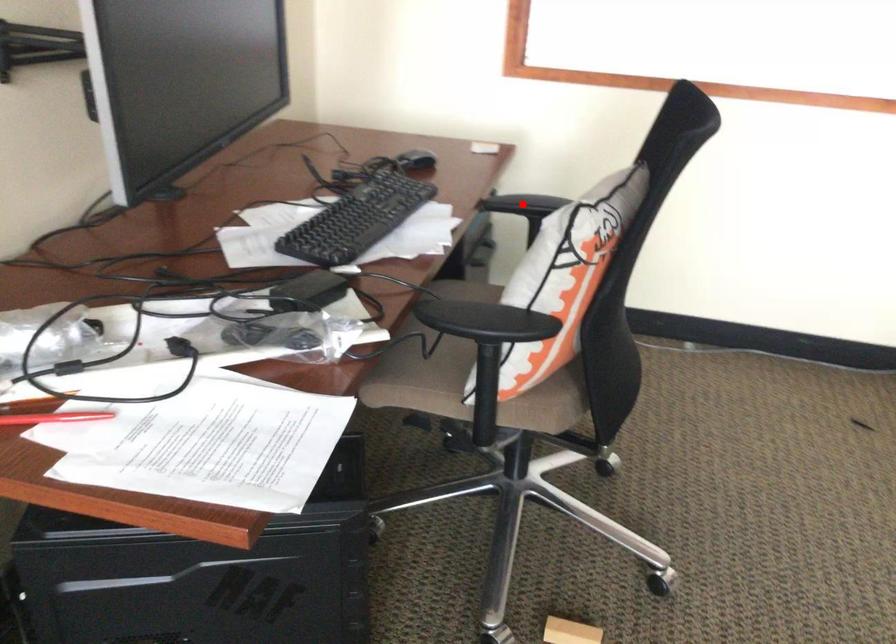
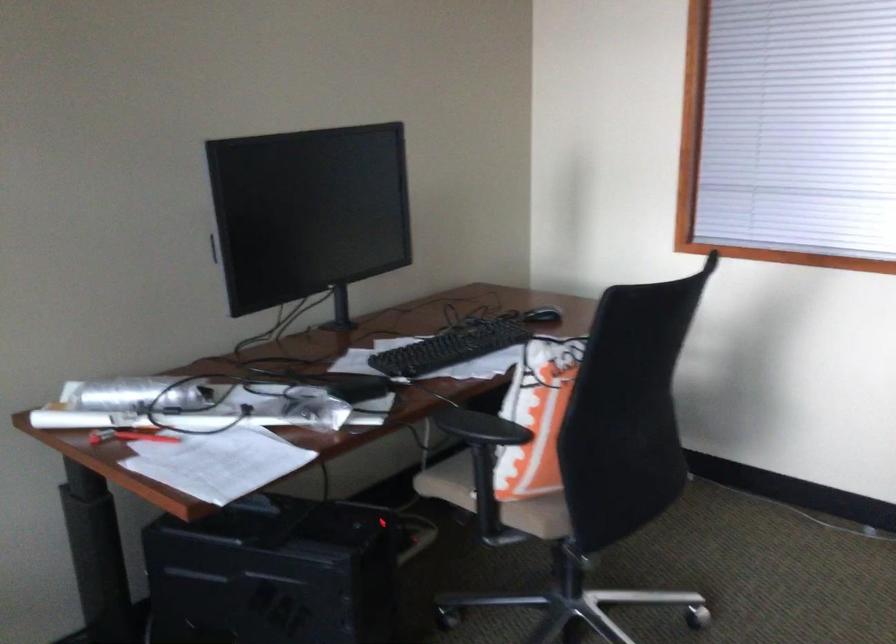
Question: I am providing you with two images of the same scene from different viewpoints. A red point is marked on the first image. Is the red point's position out of view in image 2?

Choices:
 (A) Yes
 (B) No

Answer: (A)